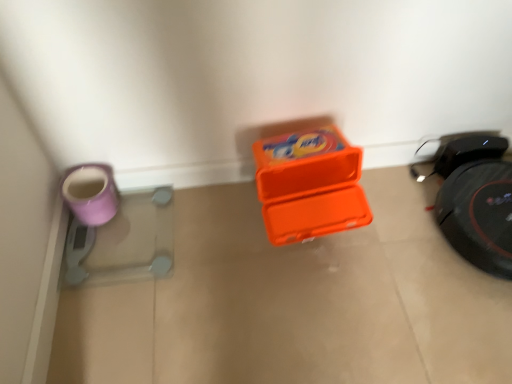
Question: In the image, is orange plastic container at center on the left side or the right side of matte purple mug at left?

Choices:
 (A) left
 (B) right

Answer: (B)

Question: Relative to matte purple mug at left, is orange plastic container at center in front or behind?

Choices:
 (A) front
 (B) behind

Answer: (A)

Question: Is orange plastic container at center taller or shorter than matte purple mug at left?

Choices:
 (A) short
 (B) tall

Answer: (A)

Question: Is matte purple mug at left taller or shorter than orange plastic container at center?

Choices:
 (A) short
 (B) tall

Answer: (B)

Question: Is matte purple mug at left bigger or smaller than orange plastic container at center?

Choices:
 (A) small
 (B) big

Answer: (A)

Question: In the image, is matte purple mug at left positioned in front of or behind orange plastic container at center?

Choices:
 (A) behind
 (B) front

Answer: (A)

Question: Based on their positions, is matte purple mug at left located to the left or right of orange plastic container at center?

Choices:
 (A) left
 (B) right

Answer: (A)